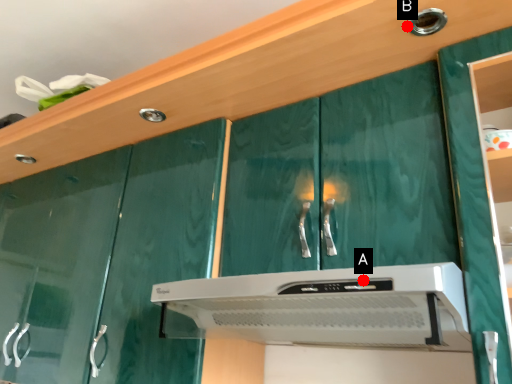
Question: Two points are circled on the image, labeled by A and B beside each circle. Which point is closer to the camera?

Choices:
 (A) A is closer
 (B) B is closer

Answer: (A)